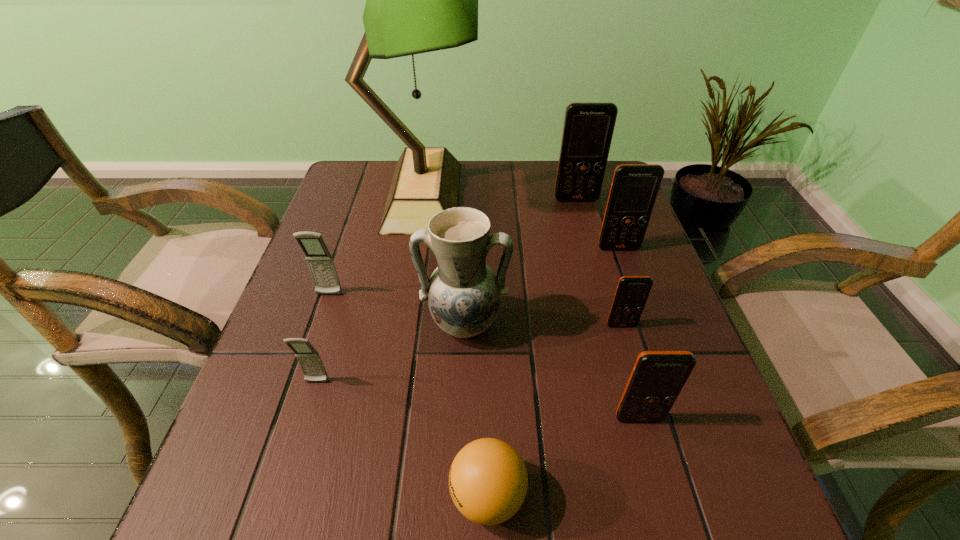
The image size is (960, 540). Find the location of `green table lamp`. green table lamp is located at coordinates (418, 0).

You are a GUI agent. You are given a task and a screenshot of the screen. Output one action in this format:
    pyautogui.click(x=<x>, y=<y>)
    Task: Click on the table lamp
    The width and height of the screenshot is (960, 540).
    Given the screenshot: What is the action you would take?
    pyautogui.click(x=418, y=0)

The image size is (960, 540). What are the coordinates of `the biggest orange cellular telephone` in the screenshot? It's located at (588, 128).

I want to click on the tallest cellular telephone, so click(588, 128).

At what (x,y) coordinates should I click in order to perform the action: click on pottery. Please return your answer as a coordinate pair (x, y). The image size is (960, 540). Looking at the image, I should click on (464, 294).

You are a GUI agent. You are given a task and a screenshot of the screen. Output one action in this format:
    pyautogui.click(x=<x>, y=<y>)
    Task: Click on the second farthest orange cellular telephone
    
    Given the screenshot: What is the action you would take?
    pyautogui.click(x=634, y=189)

This screenshot has height=540, width=960. I want to click on the second tallest cellular telephone, so click(x=634, y=189).

I want to click on the bigger gray cellular telephone, so click(320, 262).

Identify the location of the fourth nearest cellular telephone. (320, 262).

The width and height of the screenshot is (960, 540). What are the coordinates of `the third biggest orange cellular telephone` in the screenshot? It's located at (657, 378).